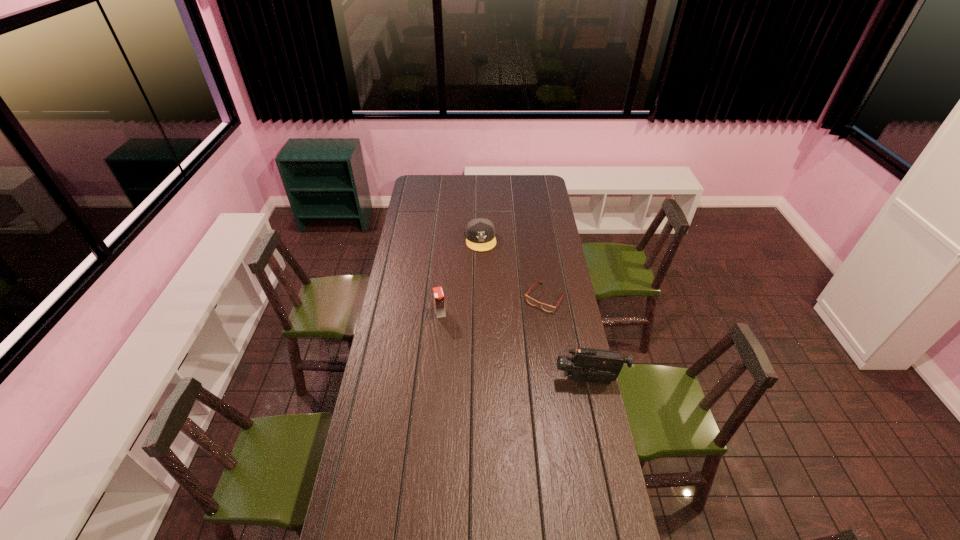
Find the location of `vacant point at the left edge`. vacant point at the left edge is located at coordinates (423, 197).

Locate an element on the screen. vacant area at the right edge is located at coordinates (576, 319).

Locate an element on the screen. vacant point at the far left corner is located at coordinates (422, 178).

Find the location of a particular element. The height and width of the screenshot is (540, 960). vacant area at the near left corner is located at coordinates (385, 527).

Identify the location of empty location between the leftmost object and the nearest object. (515, 346).

The width and height of the screenshot is (960, 540). What are the coordinates of `free space between the spectacles and the camcorder` in the screenshot? It's located at (566, 339).

The width and height of the screenshot is (960, 540). I want to click on free spot between the third tallest object and the orange juice, so click(461, 276).

You are a GUI agent. You are given a task and a screenshot of the screen. Output one action in this format:
    pyautogui.click(x=<x>, y=<y>)
    Task: Click on the free space between the leftmost object and the tallest object
    The width and height of the screenshot is (960, 540).
    Given the screenshot: What is the action you would take?
    pyautogui.click(x=515, y=346)

Find the location of `unoccupied position between the tallest object and the third object from right to left`. unoccupied position between the tallest object and the third object from right to left is located at coordinates coord(535,309).

In order to click on empty space that is in between the tallest object and the shortest object in this screenshot , I will do `click(566, 339)`.